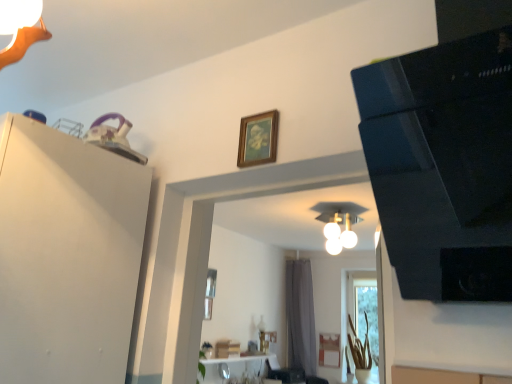
What do you see at coordinates (362, 319) in the screenshot? The image size is (512, 384). I see `translucent glass vase at lower right` at bounding box center [362, 319].

What do you see at coordinates (339, 231) in the screenshot? I see `white glossy light fixture at center` at bounding box center [339, 231].

Image resolution: width=512 pixels, height=384 pixels. Identify the location of wooden picture frame at upper center. (258, 139).

Locate an element on the screen. Image resolution: width=512 pixels, height=384 pixels. gray fabric curtain at center is located at coordinates (300, 316).

Is white matte dresser at upper left not close to translucent glass vase at lower right?

Indeed, white matte dresser at upper left is not near translucent glass vase at lower right.

Can you confirm if white matte dresser at upper left is shorter than translucent glass vase at lower right?

Yes, white matte dresser at upper left is shorter than translucent glass vase at lower right.

From the image's perspective, is white matte dresser at upper left positioned above or below translucent glass vase at lower right?

white matte dresser at upper left is above translucent glass vase at lower right.

In the scene shown: Is there a large distance between white glossy light fixture at center and gray fabric curtain at center?

white glossy light fixture at center is far away from gray fabric curtain at center.

Measure the distance from white glossy light fixture at center to gray fabric curtain at center.

10.83 feet.

Between white glossy light fixture at center and gray fabric curtain at center, which one has smaller width?

Thinner between the two is gray fabric curtain at center.

Is wooden picture frame at upper center to the right of white glossy light fixture at center from the viewer's perspective?

No, wooden picture frame at upper center is not to the right of white glossy light fixture at center.

Between wooden picture frame at upper center and white glossy light fixture at center, which one is positioned behind?

white glossy light fixture at center is behind.

Is wooden picture frame at upper center positioned far away from white glossy light fixture at center?

Yes, wooden picture frame at upper center is far from white glossy light fixture at center.

Is gray fabric curtain at center directly adjacent to black glossy speaker at upper right?

No, gray fabric curtain at center is not next to black glossy speaker at upper right.

How many degrees apart are the facing directions of gray fabric curtain at center and black glossy speaker at upper right?

The facing directions of gray fabric curtain at center and black glossy speaker at upper right are 0.254 degrees apart.

The width and height of the screenshot is (512, 384). Find the location of `curtain behind the black glossy speaker at upper right`. curtain behind the black glossy speaker at upper right is located at coordinates (300, 316).

Can you confirm if gray fabric curtain at center is shorter than black glossy speaker at upper right?

In fact, gray fabric curtain at center may be taller than black glossy speaker at upper right.

Does white glossy light fixture at center have a smaller size compared to white matte dresser at upper left?

Yes, white glossy light fixture at center is smaller than white matte dresser at upper left.

Identify the location of dresser that is in front of the white glossy light fixture at center. (67, 255).

Which object is closer to the camera, white glossy light fixture at center or white matte dresser at upper left?

white matte dresser at upper left is more forward.

Is white glossy light fixture at center outside of white matte dresser at upper left?

Yes, white glossy light fixture at center is not within white matte dresser at upper left.

Does white glossy light fixture at center touch black glossy speaker at upper right?

No, white glossy light fixture at center is not beside black glossy speaker at upper right.

Which object is further away from the camera taking this photo, white glossy light fixture at center or black glossy speaker at upper right?

white glossy light fixture at center is further away from the camera.

Can you tell me how much white glossy light fixture at center and black glossy speaker at upper right differ in facing direction?

The facing directions of white glossy light fixture at center and black glossy speaker at upper right are 2.15 degrees apart.

Could you tell me if white glossy light fixture at center is facing black glossy speaker at upper right?

No, white glossy light fixture at center is not oriented towards black glossy speaker at upper right.

From the image's perspective, which one is positioned lower, gray fabric curtain at center or translucent glass vase at lower right?

translucent glass vase at lower right.

You are a GUI agent. You are given a task and a screenshot of the screen. Output one action in this format:
    pyautogui.click(x=<x>, y=<y>)
    Task: Click on the curtain located above the translucent glass vase at lower right (from a real-world perspective)
    The image size is (512, 384).
    Given the screenshot: What is the action you would take?
    pyautogui.click(x=300, y=316)

Is gray fabric curtain at center facing towards translucent glass vase at lower right?

No, gray fabric curtain at center is not oriented towards translucent glass vase at lower right.

From a real-world perspective, which object stands above the other?

gray fabric curtain at center.

Identify the location of dresser on the left of translucent glass vase at lower right. (67, 255).

Identify the location of light fixture in front of the gray fabric curtain at center. The width and height of the screenshot is (512, 384). click(339, 231).

In the scene shown: Which object lies nearer to the anchor point white glossy light fixture at center, white matte dresser at upper left or black glossy speaker at upper right?

Among the two, white matte dresser at upper left is located nearer to white glossy light fixture at center.

When comparing their distances from white glossy light fixture at center, does wooden picture frame at upper center or translucent glass vase at lower right seem closer?

translucent glass vase at lower right is closer to white glossy light fixture at center.

In the scene shown: Considering their positions, is black glossy speaker at upper right positioned closer to gray fabric curtain at center than wooden picture frame at upper center?

Among the two, wooden picture frame at upper center is located nearer to gray fabric curtain at center.

Which object lies nearer to the anchor point gray fabric curtain at center, translucent glass vase at lower right or white matte dresser at upper left?

translucent glass vase at lower right is closer to gray fabric curtain at center.

From the image, which object appears to be nearer to white glossy light fixture at center, black glossy speaker at upper right or white matte dresser at upper left?

white matte dresser at upper left.

From the image, which object appears to be nearer to translucent glass vase at lower right, gray fabric curtain at center or white glossy light fixture at center?

Based on the image, gray fabric curtain at center appears to be nearer to translucent glass vase at lower right.

Which object lies nearer to the anchor point translucent glass vase at lower right, wooden picture frame at upper center or white glossy light fixture at center?

white glossy light fixture at center.

Considering their positions, is white matte dresser at upper left positioned further to wooden picture frame at upper center than translucent glass vase at lower right?

translucent glass vase at lower right.

You are a GUI agent. You are given a task and a screenshot of the screen. Output one action in this format:
    pyautogui.click(x=<x>, y=<y>)
    Task: Click on the light fixture between white matte dresser at upper left and gray fabric curtain at center along the z-axis
    This screenshot has height=384, width=512.
    Given the screenshot: What is the action you would take?
    pyautogui.click(x=339, y=231)

Locate an element on the screen. window between black glossy speaker at upper right and gray fabric curtain at center from front to back is located at coordinates point(362,319).

At what (x,y) coordinates should I click in order to perform the action: click on window between wooden picture frame at upper center and gray fabric curtain at center in the front-back direction. Please return your answer as a coordinate pair (x, y). Looking at the image, I should click on point(362,319).

At what (x,y) coordinates should I click in order to perform the action: click on dresser positioned between black glossy speaker at upper right and gray fabric curtain at center from near to far. Please return your answer as a coordinate pair (x, y). The image size is (512, 384). Looking at the image, I should click on (67, 255).